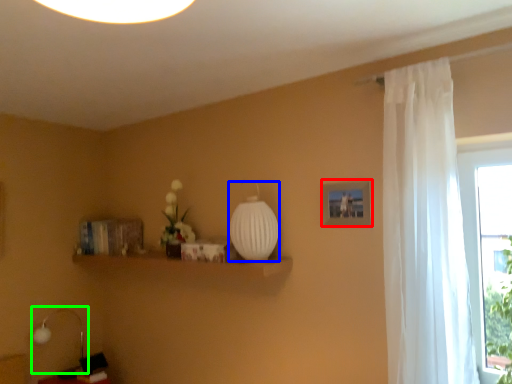
Question: Considering the real-world distances, which object is closest to picture frame (highlighted by a red box)? glass vase (highlighted by a blue box) or table lamp (highlighted by a green box).

Choices:
 (A) glass vase
 (B) table lamp

Answer: (A)